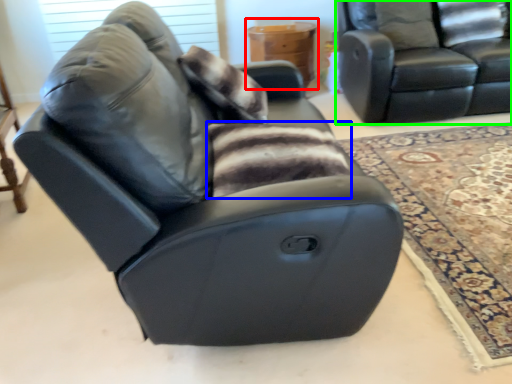
Question: Estimate the real-world distances between objects in this image. Which object is closer to table (highlighted by a red box), blanket (highlighted by a blue box) or studio couch (highlighted by a green box)?

Choices:
 (A) blanket
 (B) studio couch

Answer: (B)